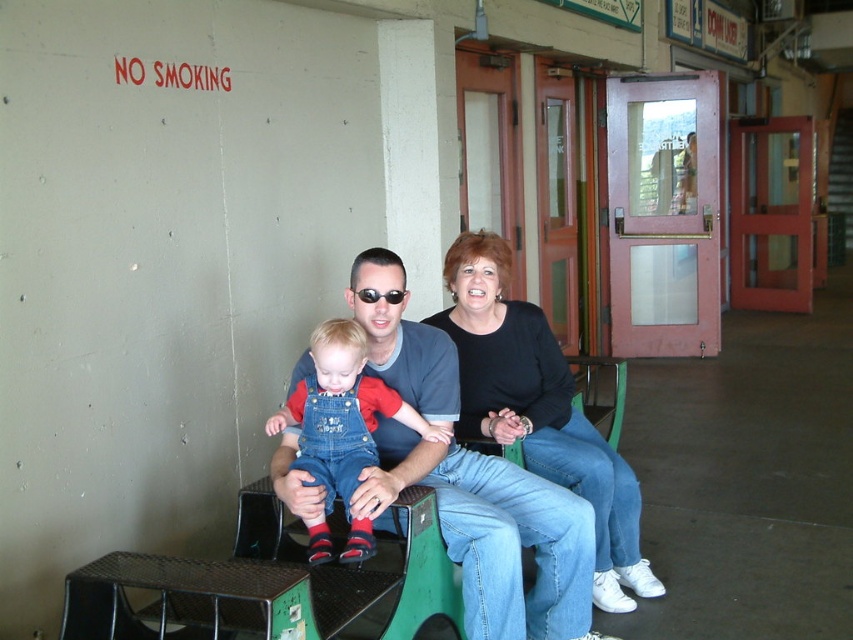
Question: Is denim overalls at center above black plastic sunglasses at center?

Choices:
 (A) yes
 (B) no

Answer: (B)

Question: Which is farther from the matte blue jeans at center?

Choices:
 (A) black plastic sunglasses at center
 (B) black matte shirt at center

Answer: (A)

Question: Can you confirm if black matte shirt at center is positioned below black plastic sunglasses at center?

Choices:
 (A) yes
 (B) no

Answer: (A)

Question: Which object is farther from the camera taking this photo?

Choices:
 (A) black matte shirt at center
 (B) black plastic sunglasses at center
 (C) denim overalls at center
 (D) matte blue jeans at center

Answer: (A)

Question: Is matte blue jeans at center positioned at the back of denim overalls at center?

Choices:
 (A) yes
 (B) no

Answer: (A)

Question: Which object appears farthest from the camera in this image?

Choices:
 (A) denim overalls at center
 (B) black matte shirt at center
 (C) black plastic sunglasses at center

Answer: (B)